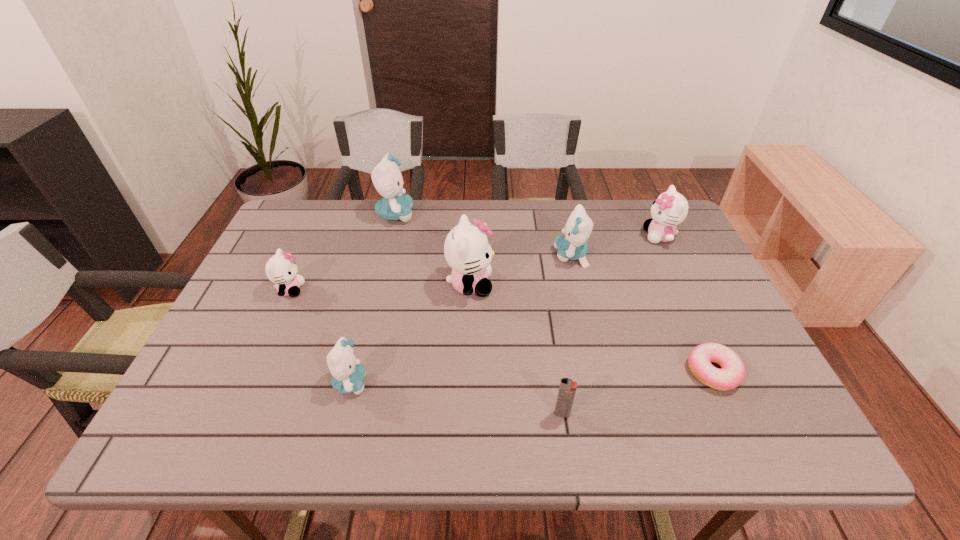
This screenshot has height=540, width=960. What are the coordinates of `free spot located on the front-facing side of the second biggest white kitten` in the screenshot? It's located at (601, 236).

Where is `free space located 0.190m on the front-facing side of the second biggest white kitten`? This screenshot has width=960, height=540. free space located 0.190m on the front-facing side of the second biggest white kitten is located at coordinates (581, 236).

Find the location of a particular element. Image resolution: width=960 pixels, height=540 pixels. vacant space located on the front-facing side of the second biggest white kitten is located at coordinates 528,236.

Find the location of a particular element. The height and width of the screenshot is (540, 960). vacant space situated 0.230m on the front-facing side of the leftmost object is located at coordinates (391, 289).

I want to click on vacant region located 0.050m on the face of the nearest blue kitten, so click(x=391, y=383).

Image resolution: width=960 pixels, height=540 pixels. What are the coordinates of `free spot located 0.350m on the back of the fourth object from right to left` in the screenshot? It's located at (543, 291).

Identify the location of vacant space situated 0.070m on the back of the pink doughnut. The height and width of the screenshot is (540, 960). pos(693,327).

What are the coordinates of `object positioned at the near edge` in the screenshot? It's located at (567, 388).

Identify the location of object located in the left edge section of the desktop. This screenshot has width=960, height=540. (281, 269).

At what (x,y) coordinates should I click in order to perform the action: click on kitten present at the right edge. Please return your answer as a coordinate pair (x, y). Image resolution: width=960 pixels, height=540 pixels. Looking at the image, I should click on (670, 209).